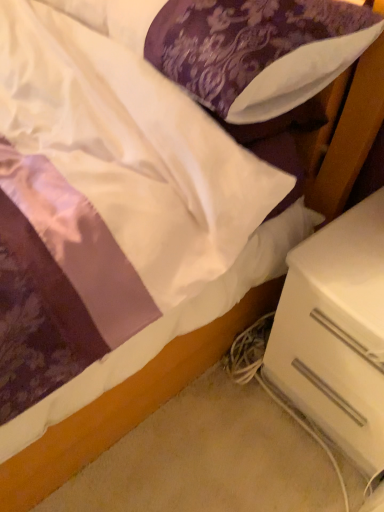
Where is `white plastic drawer at lower right`? The width and height of the screenshot is (384, 512). white plastic drawer at lower right is located at coordinates (336, 332).

From the picture: Measure the distance between point (324,327) and camera.

Point (324,327) and camera are 34.29 inches apart from each other.

Describe the element at coordinates (336, 332) in the screenshot. This screenshot has height=512, width=384. I see `white plastic drawer at lower right` at that location.

Measure the distance between white plastic drawer at lower right and camera.

A distance of 28.46 inches exists between white plastic drawer at lower right and camera.

Describe the element at coordinates (303, 63) in the screenshot. I see `white satin pillow at upper center` at that location.

The width and height of the screenshot is (384, 512). I want to click on white satin pillow at upper center, so click(x=303, y=63).

In order to face white satin pillow at upper center, should I rotate leftwards or rightwards?

Turn left approximately 2.786 degrees to face it.

Where is `white plastic drawer at lower right`? Image resolution: width=384 pixels, height=512 pixels. white plastic drawer at lower right is located at coordinates (336, 332).

Looking at this image, can you confirm if white plastic drawer at lower right is positioned to the right of white satin pillow at upper center?

Yes, white plastic drawer at lower right is to the right of white satin pillow at upper center.

Which is behind, white plastic drawer at lower right or white satin pillow at upper center?

white plastic drawer at lower right is further away from the camera.

Does point (381, 455) come in front of point (294, 81)?

No, it is behind (294, 81).

From the image's perspective, is white plastic drawer at lower right above or below white satin pillow at upper center?

white plastic drawer at lower right is below white satin pillow at upper center.

From a real-world perspective, does white plastic drawer at lower right stand above white satin pillow at upper center?

No, from a real-world perspective, white plastic drawer at lower right is not on top of white satin pillow at upper center.

Can you confirm if white plastic drawer at lower right is thinner than white satin pillow at upper center?

No, white plastic drawer at lower right is not thinner than white satin pillow at upper center.

Considering the sizes of objects white plastic drawer at lower right and white satin pillow at upper center in the image provided, who is taller, white plastic drawer at lower right or white satin pillow at upper center?

white plastic drawer at lower right is taller.

In terms of size, does white plastic drawer at lower right appear bigger or smaller than white satin pillow at upper center?

A: Considering their sizes, white plastic drawer at lower right takes up more space than white satin pillow at upper center.

Which is correct: white plastic drawer at lower right is inside white satin pillow at upper center, or outside of it?

white plastic drawer at lower right is located beyond the bounds of white satin pillow at upper center.

Is white plastic drawer at lower right touching white satin pillow at upper center?

There is a gap between white plastic drawer at lower right and white satin pillow at upper center.

Is white plastic drawer at lower right looking in the opposite direction of white satin pillow at upper center?

No, white plastic drawer at lower right is not facing the opposite direction of white satin pillow at upper center.

What's the angular difference between white plastic drawer at lower right and white satin pillow at upper center's facing directions?

They differ by 1.75 degrees in their facing directions.

Find the location of `nightstand on the right of white satin pillow at upper center`. nightstand on the right of white satin pillow at upper center is located at coordinates (336, 332).

Based on their positions, is white satin pillow at upper center located to the left or right of white plastic drawer at lower right?

In the image, white satin pillow at upper center appears on the left side of white plastic drawer at lower right.

Considering their positions, is white satin pillow at upper center located in front of or behind white plastic drawer at lower right?

Visually, white satin pillow at upper center is located in front of white plastic drawer at lower right.

Considering the positions of points (223, 101) and (335, 305), is point (223, 101) closer to camera compared to point (335, 305)?

Yes, it is in front of point (335, 305).

From the image's perspective, between white satin pillow at upper center and white plastic drawer at lower right, which one is located above?

white satin pillow at upper center, from the image's perspective.

From a real-world perspective, which is physically above, white satin pillow at upper center or white plastic drawer at lower right?

white satin pillow at upper center, from a real-world perspective.

Which object is thinner, white satin pillow at upper center or white plastic drawer at lower right?

white satin pillow at upper center.

Considering the sizes of white satin pillow at upper center and white plastic drawer at lower right in the image, is white satin pillow at upper center taller or shorter than white plastic drawer at lower right?

white satin pillow at upper center is shorter than white plastic drawer at lower right.

From the picture: Considering the relative sizes of white satin pillow at upper center and white plastic drawer at lower right in the image provided, is white satin pillow at upper center bigger than white plastic drawer at lower right?

No, white satin pillow at upper center is not bigger than white plastic drawer at lower right.

Does white satin pillow at upper center contain white plastic drawer at lower right?

No, white plastic drawer at lower right is not a part of white satin pillow at upper center.

Is white satin pillow at upper center next to white plastic drawer at lower right and touching it?

white satin pillow at upper center is not next to white plastic drawer at lower right, and they're not touching.

Is white satin pillow at upper center facing towards white plastic drawer at lower right?

No.

Can you tell me how much white satin pillow at upper center and white plastic drawer at lower right differ in facing direction?

The angular difference between white satin pillow at upper center and white plastic drawer at lower right is 1.75 degrees.

Locate an element on the screen. This screenshot has height=512, width=384. nightstand on the right of white satin pillow at upper center is located at coordinates (336, 332).

The height and width of the screenshot is (512, 384). Identify the location of pillow to the left of white plastic drawer at lower right. (303, 63).

Identify the location of nightstand below the white satin pillow at upper center (from the image's perspective). Image resolution: width=384 pixels, height=512 pixels. (336, 332).